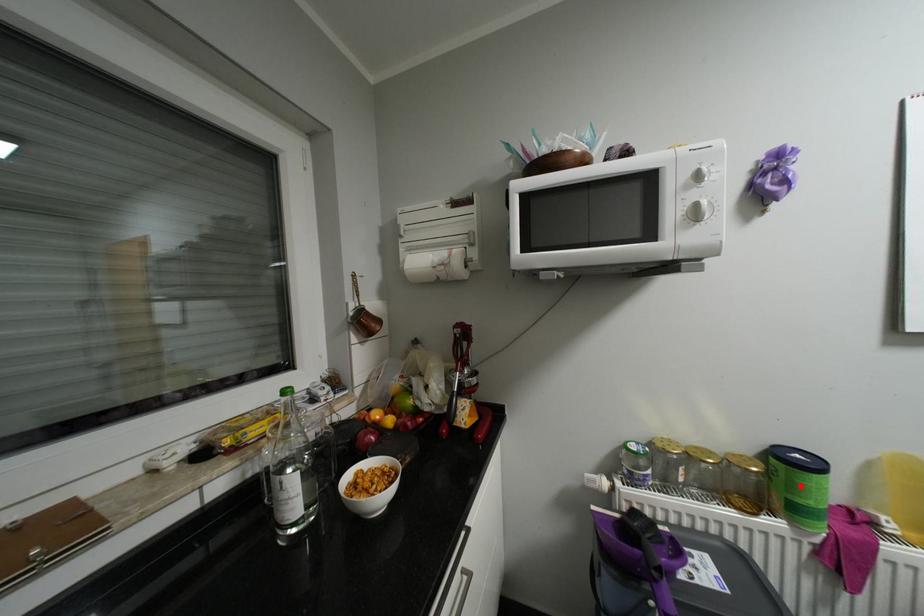
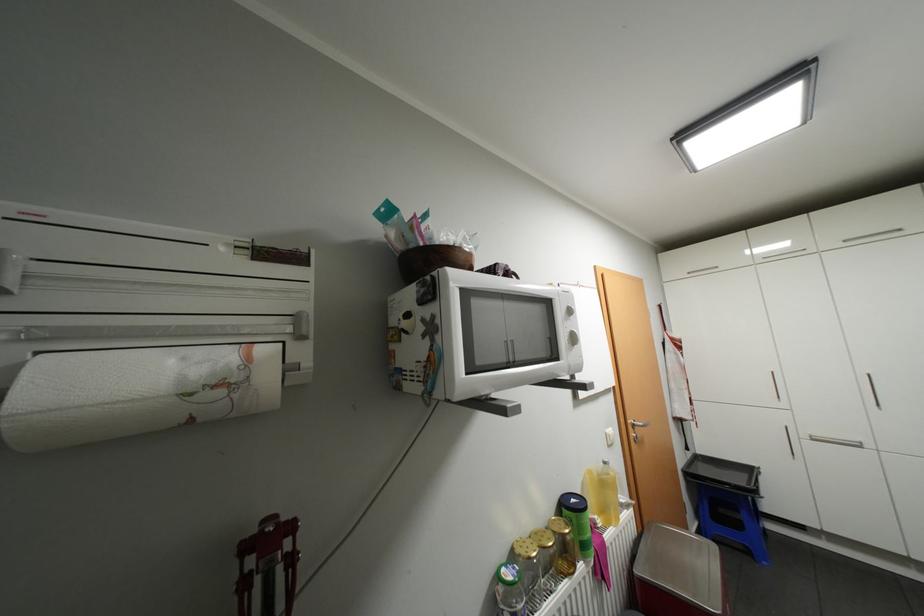
Question: A red point is marked in image1. In image2, is the corresponding 3D point closer to the camera or farther? Reply with the corresponding letter.

Choices:
 (A) The corresponding 3D point is closer.
 (B) The corresponding 3D point is farther.

Answer: (B)